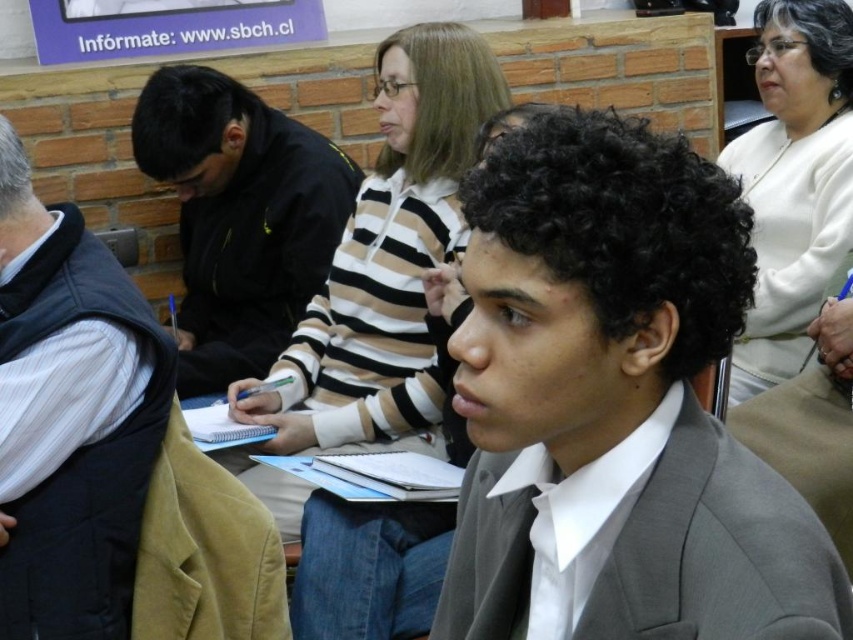
Consider the image. Is dark gray vest at left to the right of striped sweater at center from the viewer's perspective?

In fact, dark gray vest at left is to the left of striped sweater at center.

You are a GUI agent. You are given a task and a screenshot of the screen. Output one action in this format:
    pyautogui.click(x=<x>, y=<y>)
    Task: Click on the dark gray vest at left
    This screenshot has width=853, height=640.
    Given the screenshot: What is the action you would take?
    pyautogui.click(x=70, y=417)

You are a GUI agent. You are given a task and a screenshot of the screen. Output one action in this format:
    pyautogui.click(x=<x>, y=<y>)
    Task: Click on the dark gray vest at left
    The image size is (853, 640).
    Given the screenshot: What is the action you would take?
    pyautogui.click(x=70, y=417)

Which is more to the right, matte gray suit at center or white soft sweater at upper right?

From the viewer's perspective, white soft sweater at upper right appears more on the right side.

Can you confirm if matte gray suit at center is positioned below white soft sweater at upper right?

Correct, matte gray suit at center is located below white soft sweater at upper right.

Does point (596, 228) come behind point (849, 163)?

That is False.

Find the location of a particular element. Image resolution: width=853 pixels, height=640 pixels. matte gray suit at center is located at coordinates (614, 404).

Does striped sweater at center lie in front of black jacket at center?

Yes, striped sweater at center is in front of black jacket at center.

Based on the photo, is striped sweater at center further to the viewer compared to black jacket at center?

No, it is not.

This screenshot has height=640, width=853. Describe the element at coordinates (386, 260) in the screenshot. I see `striped sweater at center` at that location.

Find the location of `striped sweater at center`. striped sweater at center is located at coordinates (386, 260).